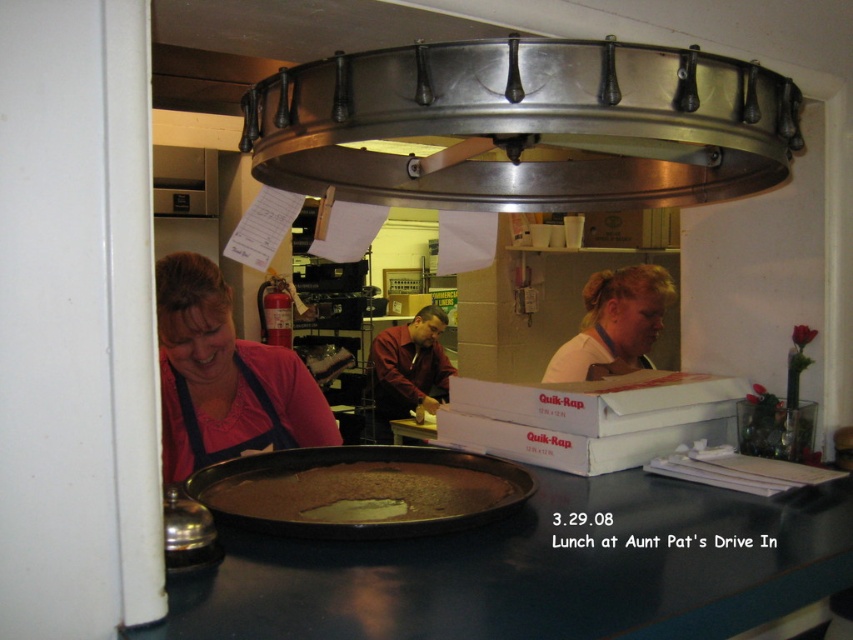
Question: Does black glossy counter top at center appear on the right side of light beige shirt at center?

Choices:
 (A) no
 (B) yes

Answer: (A)

Question: Is light beige shirt at center positioned before maroon shirt at center?

Choices:
 (A) no
 (B) yes

Answer: (B)

Question: Considering the real-world distances, which object is farthest from the brown matte pizza at center?

Choices:
 (A) matte pink shirt at lower left
 (B) black glossy counter top at center
 (C) light beige shirt at center

Answer: (C)

Question: Does matte pink shirt at lower left have a greater width compared to maroon shirt at center?

Choices:
 (A) no
 (B) yes

Answer: (B)

Question: Which object is the farthest from the black glossy counter top at center?

Choices:
 (A) brown matte pizza at center
 (B) maroon shirt at center

Answer: (B)

Question: Which is farther from the brown matte pizza at center?

Choices:
 (A) light beige shirt at center
 (B) maroon shirt at center
 (C) black glossy counter top at center

Answer: (B)